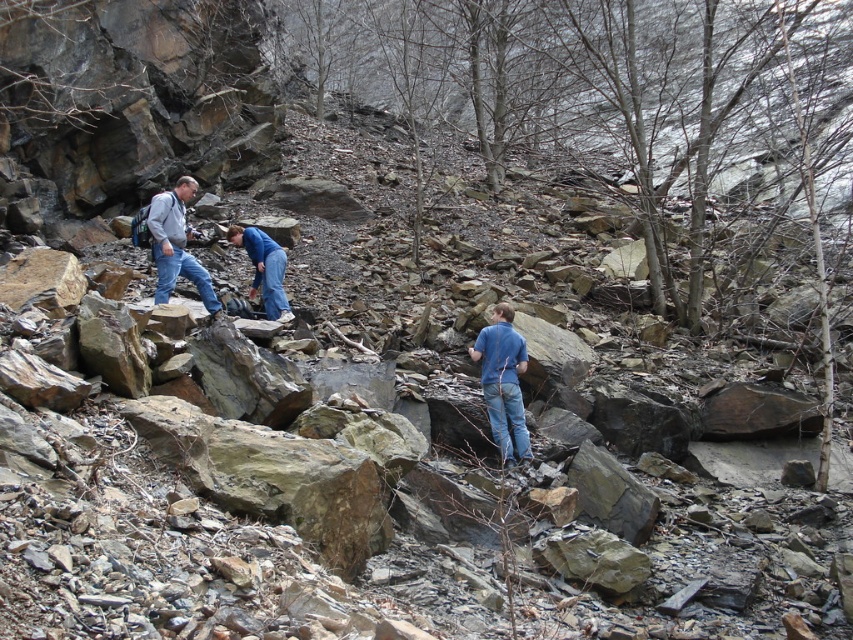
Which of these two, blue jeans at center or blue denim jeans at center, stands shorter?

Standing shorter between the two is blue denim jeans at center.

Is blue jeans at center thinner than blue denim jeans at center?

Yes, blue jeans at center is thinner than blue denim jeans at center.

I want to click on blue jeans at center, so click(x=503, y=381).

Measure the distance between denim jacket at left and camera.

denim jacket at left and camera are 37.77 feet apart.

Between point (170, 266) and point (277, 248), which one is positioned in front?

Positioned in front is point (170, 266).

Identify the location of denim jacket at left. Image resolution: width=853 pixels, height=640 pixels. (177, 244).

Is point (509, 445) closer to camera compared to point (164, 196)?

Yes.

Between blue jeans at center and denim jacket at left, which one appears on the right side from the viewer's perspective?

blue jeans at center is more to the right.

Does point (482, 332) come in front of point (189, 273)?

Yes, it is in front of point (189, 273).

Image resolution: width=853 pixels, height=640 pixels. In order to click on blue jeans at center in this screenshot , I will do `click(503, 381)`.